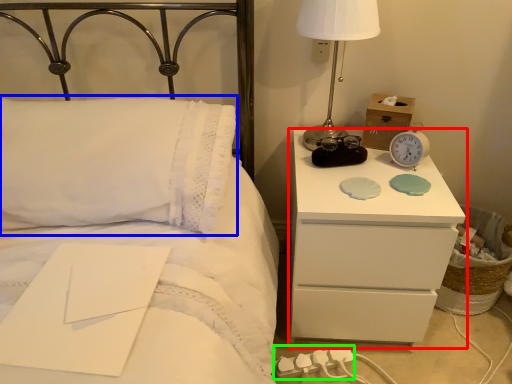
Question: Considering the real-world distances, which object is closest to nightstand (highlighted by a red box)? pillow (highlighted by a blue box) or charger (highlighted by a green box).

Choices:
 (A) pillow
 (B) charger

Answer: (B)